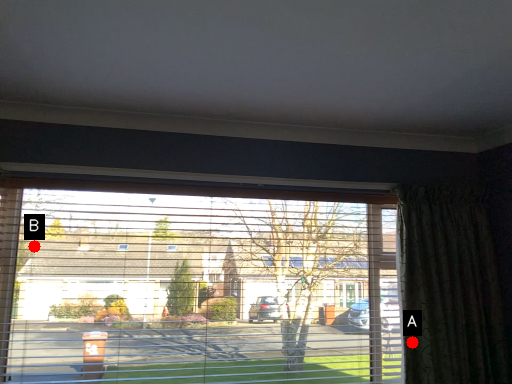
Question: Two points are circled on the image, labeled by A and B beside each circle. Which point is farther from the camera taking this photo?

Choices:
 (A) A is further
 (B) B is further

Answer: (A)